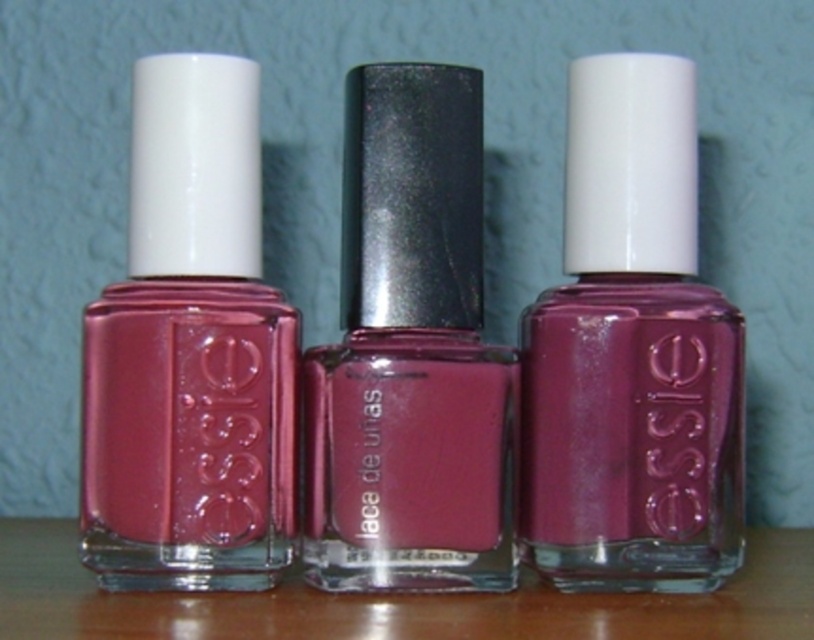
Between matte purple nail polish at center and shiny metallic nail polish at center, which one has less height?

With less height is shiny metallic nail polish at center.

Is point (602, 81) closer to camera compared to point (488, 522)?

No.

Who is more distant from viewer, (694, 502) or (314, 464)?

Point (694, 502)

I want to click on matte purple nail polish at center, so click(631, 355).

Is matte purple nail polish at center thinner than matte pink nail polish at left?

In fact, matte purple nail polish at center might be wider than matte pink nail polish at left.

What do you see at coordinates (631, 355) in the screenshot? I see `matte purple nail polish at center` at bounding box center [631, 355].

Identify the location of matte purple nail polish at center. (631, 355).

Does matte pink nail polish at left have a larger size compared to shiny metallic nail polish at center?

Yes.

Between matte pink nail polish at left and shiny metallic nail polish at center, which one appears on the left side from the viewer's perspective?

matte pink nail polish at left is more to the left.

Is point (220, 538) more distant than point (445, 468)?

No, (220, 538) is in front of (445, 468).

Find the location of a particular element. The height and width of the screenshot is (640, 814). matte pink nail polish at left is located at coordinates (190, 353).